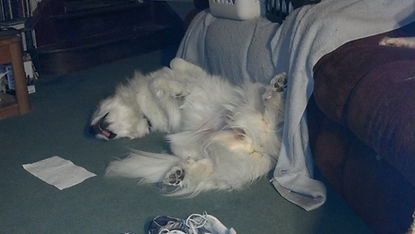
Where is `bottom step`? bottom step is located at coordinates (101, 38).